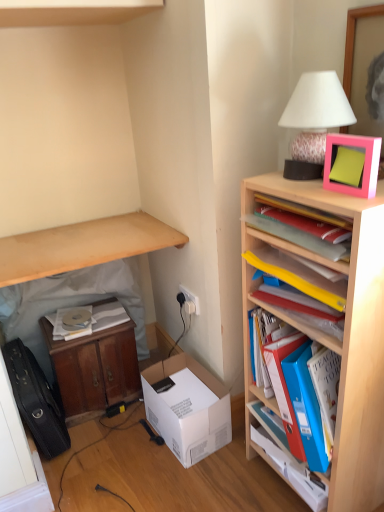
Find the location of `vacant space to the right of black leather suitcase at lower left`. vacant space to the right of black leather suitcase at lower left is located at coordinates (113, 441).